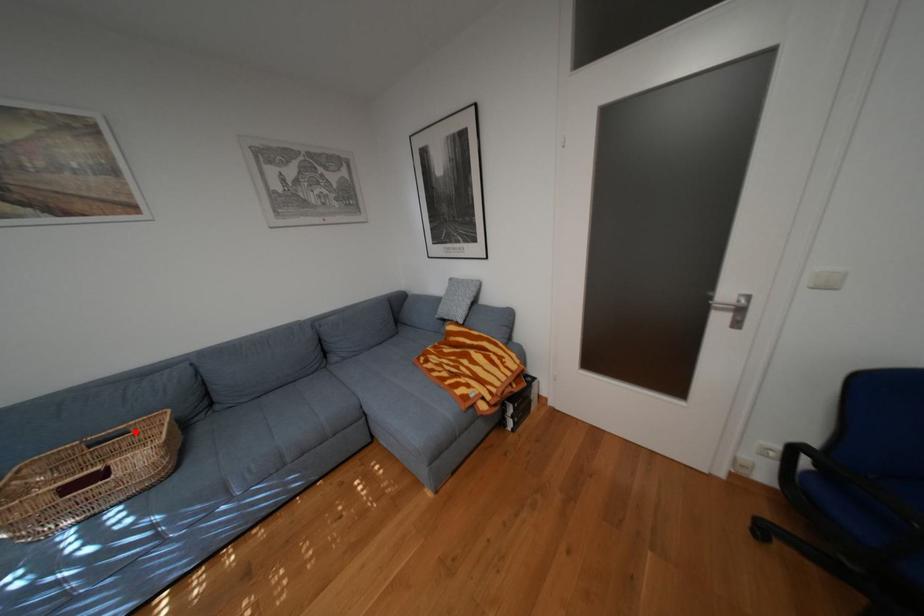
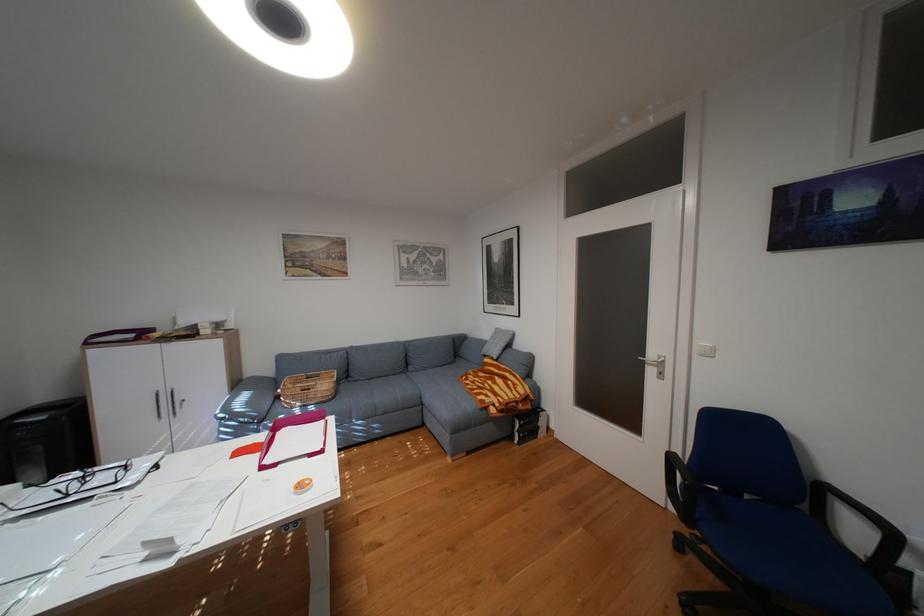
Find the pixel in the second image that matches the highlighted location in the first image.

(331, 375)